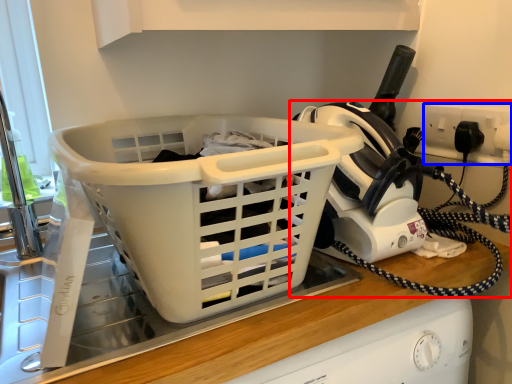
Question: Which object is closer to the camera taking this photo, home appliance (highlighted by a red box) or electric outlet (highlighted by a blue box)?

Choices:
 (A) home appliance
 (B) electric outlet

Answer: (A)